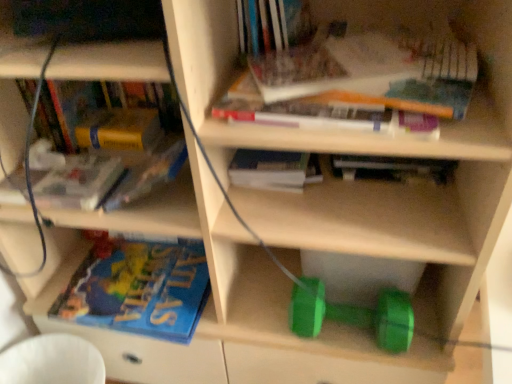
Question: From the image's perspective, is blue matte book at lower left, placed as the first book when sorted from bottom to top, positioned above or below green rubber dumbbell at lower center?

Choices:
 (A) above
 (B) below

Answer: (A)

Question: Is blue matte book at lower left, placed as the first book when sorted from bottom to top, taller or shorter than green rubber dumbbell at lower center?

Choices:
 (A) tall
 (B) short

Answer: (B)

Question: Estimate the real-world distances between objects in this image. Which object is farther from the yellow matte book at upper left, acting as the fifth book starting from the top?

Choices:
 (A) yellow matte paperback book at upper left
 (B) white plastic swivel chair at lower left
 (C) green rubber dumbbell at lower center
 (D) translucent plastic book at upper left, which appears as the sixth book when viewed from the top
 (E) hardcover book at upper center, which appears as the sixth book when ordered from the bottom

Answer: (B)

Question: Which is farther from the white plastic swivel chair at lower left?

Choices:
 (A) hardcover book at upper center, placed as the 7th book when sorted from bottom to top
 (B) blue matte book at lower left, the 7th book viewed from the top
 (C) hardcover book at upper center, the 4th book positioned from the bottom
 (D) yellow matte book at upper left, acting as the fifth book starting from the top
 (E) green rubber dumbbell at lower center

Answer: (A)